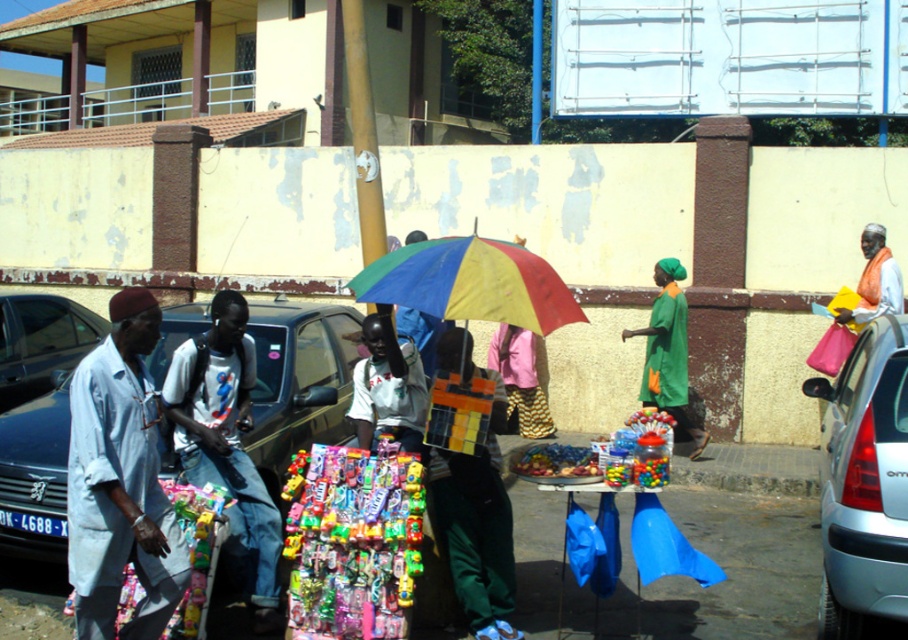
Which is in front, point (179, 324) or point (844, 532)?

Positioned in front is point (844, 532).

Between point (51, 552) and point (835, 566), which one is positioned behind?

Positioned behind is point (51, 552).

Find the location of a particular element. The height and width of the screenshot is (640, 908). blue metallic car at left is located at coordinates (298, 381).

Between blue metallic car at left and light blue fabric shirt at left, which one has less height?

Standing shorter between the two is blue metallic car at left.

The image size is (908, 640). What do you see at coordinates (298, 381) in the screenshot?
I see `blue metallic car at left` at bounding box center [298, 381].

The image size is (908, 640). What are the coordinates of `blue metallic car at left` in the screenshot? It's located at (298, 381).

Which of these two, shiny plastic candy at center or rainbow fabric umbrella at center, stands taller?

shiny plastic candy at center

Can you confirm if shiny plastic candy at center is thinner than rainbow fabric umbrella at center?

Correct, shiny plastic candy at center's width is less than rainbow fabric umbrella at center's.

Is point (405, 563) more distant than point (406, 244)?

No, it is not.

What are the coordinates of `shiny plastic candy at center` in the screenshot? It's located at point(353,541).